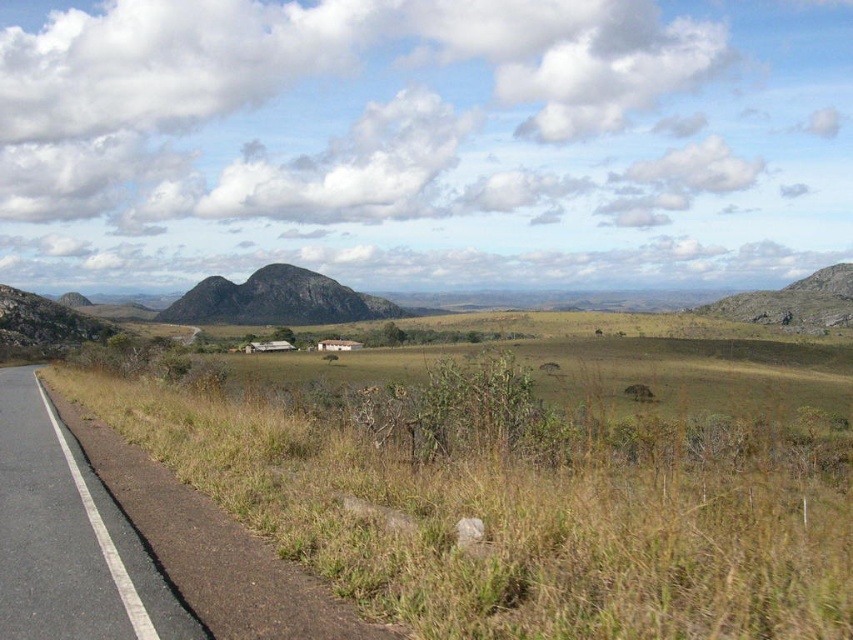
You are a GUI agent. You are given a task and a screenshot of the screen. Output one action in this format:
    pyautogui.click(x=<x>, y=<y>)
    Task: Click on the black asphalt road at left
    The image size is (853, 640).
    Given the screenshot: What is the action you would take?
    (68, 538)

Does black asphalt road at left have a lesser width compared to dark gray rock formation at center?

Yes, black asphalt road at left is thinner than dark gray rock formation at center.

Locate an element on the screen. black asphalt road at left is located at coordinates (68, 538).

Who is positioned more to the left, brown grassland at lower left or dark gray rock formation at center?

Positioned to the left is dark gray rock formation at center.

What do you see at coordinates (511, 502) in the screenshot?
I see `brown grassland at lower left` at bounding box center [511, 502].

Locate an element on the screen. This screenshot has width=853, height=640. brown grassland at lower left is located at coordinates (511, 502).

Can you confirm if brown grassland at lower left is bigger than black asphalt road at left?

Indeed, brown grassland at lower left has a larger size compared to black asphalt road at left.

Which of these two, brown grassland at lower left or black asphalt road at left, stands shorter?

With less height is black asphalt road at left.

The width and height of the screenshot is (853, 640). Find the location of `brown grassland at lower left`. brown grassland at lower left is located at coordinates (511, 502).

Where is `brown grassland at lower left`? This screenshot has width=853, height=640. brown grassland at lower left is located at coordinates 511,502.